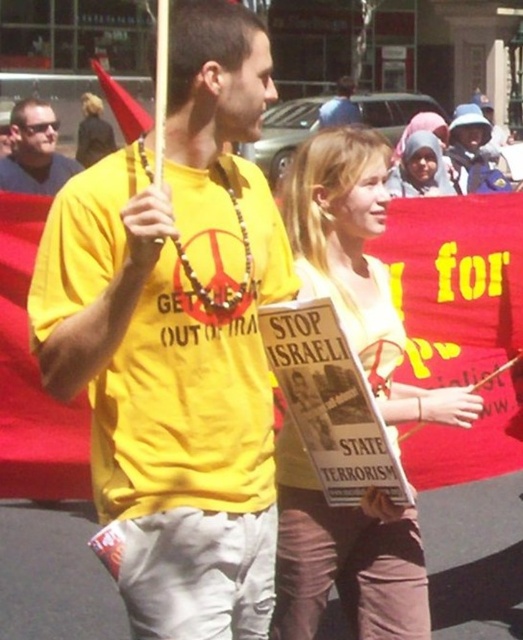
Question: Considering the real-world distances, which object is farthest from the smooth cardboard sign at center?

Choices:
 (A) yellow matte shirt at center
 (B) matte yellow t-shirt at center
 (C) matte black sunglasses at upper left

Answer: (B)

Question: Is yellow matte shirt at center to the right of matte yellow t-shirt at center from the viewer's perspective?

Choices:
 (A) yes
 (B) no

Answer: (B)

Question: Which point is farther from the camera taking this photo?

Choices:
 (A) click(52, 116)
 (B) click(337, 86)
 (C) click(416, 152)

Answer: (B)

Question: Among these objects, which one is nearest to the camera?

Choices:
 (A) matte black sunglasses at upper left
 (B) matte yellow t-shirt at center
 (C) matte pink hijab at upper center
 (D) yellow matte shirt at center

Answer: (D)

Question: Can you confirm if yellow matte shirt at center is positioned to the left of smooth cardboard sign at center?

Choices:
 (A) yes
 (B) no

Answer: (A)

Question: Is yellow matte shirt at center closer to the viewer compared to matte black sunglasses at upper left?

Choices:
 (A) yes
 (B) no

Answer: (A)